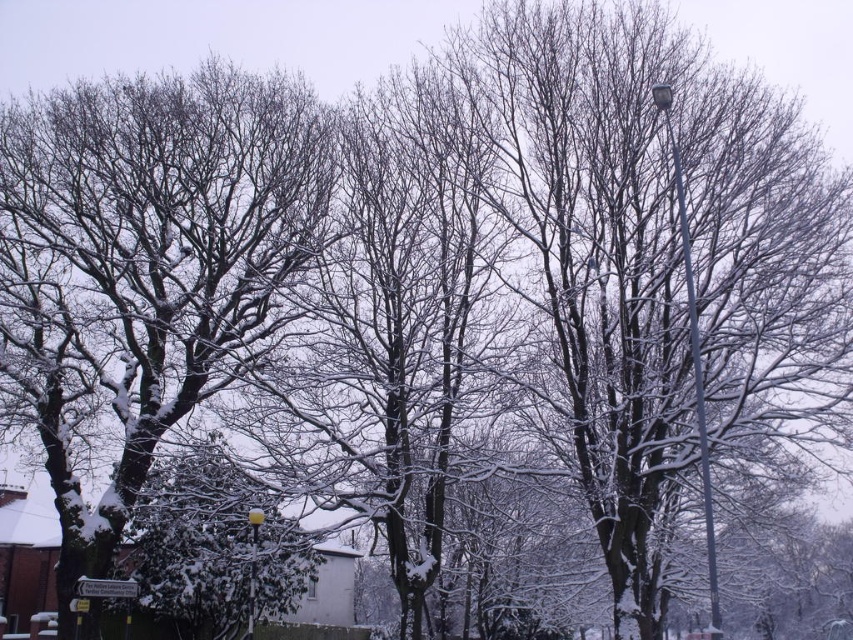
You are a photographer planning to capture the winter scene. You notice the metallic gray pole at right and the yellow glass lamp post at center. Which object would appear wider in your photo?

The metallic gray pole at right would appear wider in the photo since its width surpasses that of the yellow glass lamp post at center.